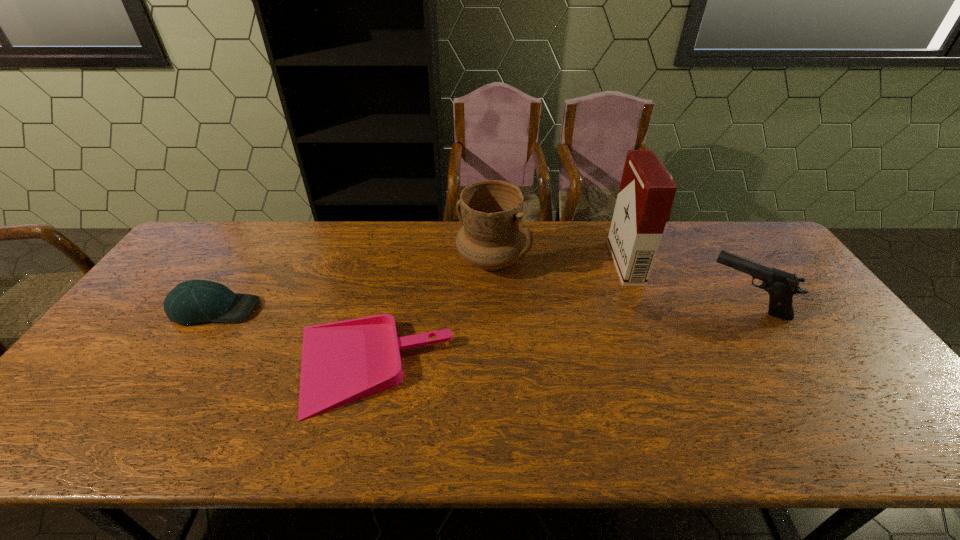
Where is `free location located on the front-facing side of the second object from right to left`? free location located on the front-facing side of the second object from right to left is located at coordinates (502, 263).

At what (x,y) coordinates should I click in order to perform the action: click on vacant region located on the left of the pottery. Please return your answer as a coordinate pair (x, y). This screenshot has width=960, height=540. Looking at the image, I should click on (420, 260).

Locate an element on the screen. This screenshot has height=540, width=960. free space located 0.350m at the muzzle of the gun is located at coordinates (590, 303).

This screenshot has height=540, width=960. I want to click on blank space located at the muzzle of the gun, so (x=621, y=303).

This screenshot has width=960, height=540. Find the location of `vacant space situated 0.240m at the muzzle of the gun`. vacant space situated 0.240m at the muzzle of the gun is located at coordinates (628, 303).

In order to click on vacant space located on the right of the baseball cap in this screenshot , I will do `click(391, 309)`.

I want to click on free space located on the handle side of the shortest object, so click(x=128, y=368).

The height and width of the screenshot is (540, 960). Find the location of `free spot located on the handle side of the shortest object`. free spot located on the handle side of the shortest object is located at coordinates (200, 368).

I want to click on free spot located on the handle side of the shortest object, so click(x=224, y=368).

At what (x,y) coordinates should I click in order to perform the action: click on cigarette_case that is positioned at the far edge. Please return your answer as a coordinate pair (x, y). Image resolution: width=960 pixels, height=540 pixels. Looking at the image, I should click on (646, 193).